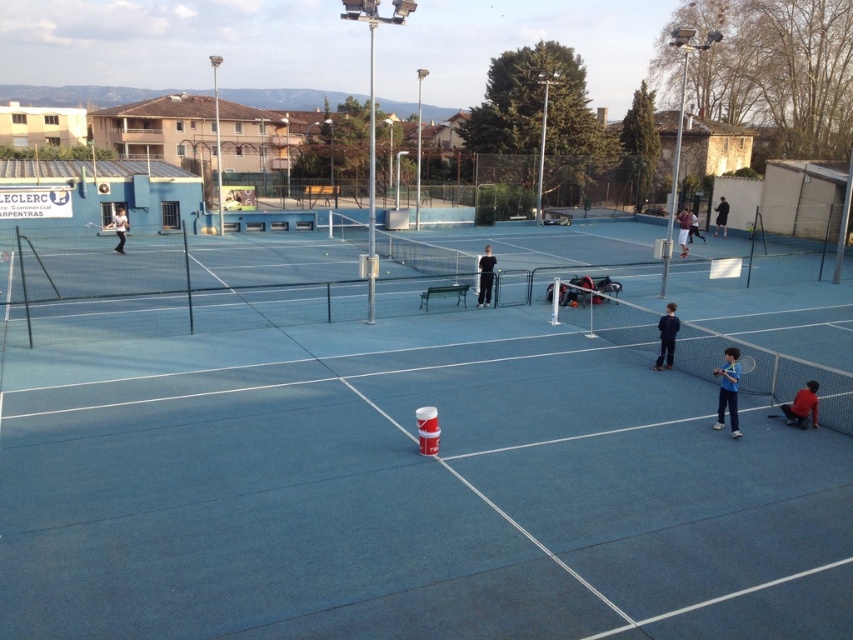
Question: Which point appears farthest from the camera in this image?

Choices:
 (A) pos(814,392)
 (B) pos(666,328)
 (C) pos(115,234)

Answer: (C)

Question: Considering the relative positions of black fabric person at center and blue matte tennis racket at center in the image provided, where is black fabric person at center located with respect to blue matte tennis racket at center?

Choices:
 (A) right
 (B) left

Answer: (B)

Question: Which of the following is the closest to the observer?

Choices:
 (A) (117, 232)
 (B) (802, 412)
 (C) (488, 266)
 (D) (724, 227)

Answer: (B)

Question: Can you confirm if blue fabric shirt at center is positioned below red matte tennis racket at lower right?

Choices:
 (A) yes
 (B) no

Answer: (B)

Question: Is blue fabric shirt at center above black fabric person at center?

Choices:
 (A) yes
 (B) no

Answer: (B)

Question: Which object is positioned closest to the blue fabric shirt at center?

Choices:
 (A) blue rubber tennis court at center
 (B) dark blue fabric tennis racket at right

Answer: (A)